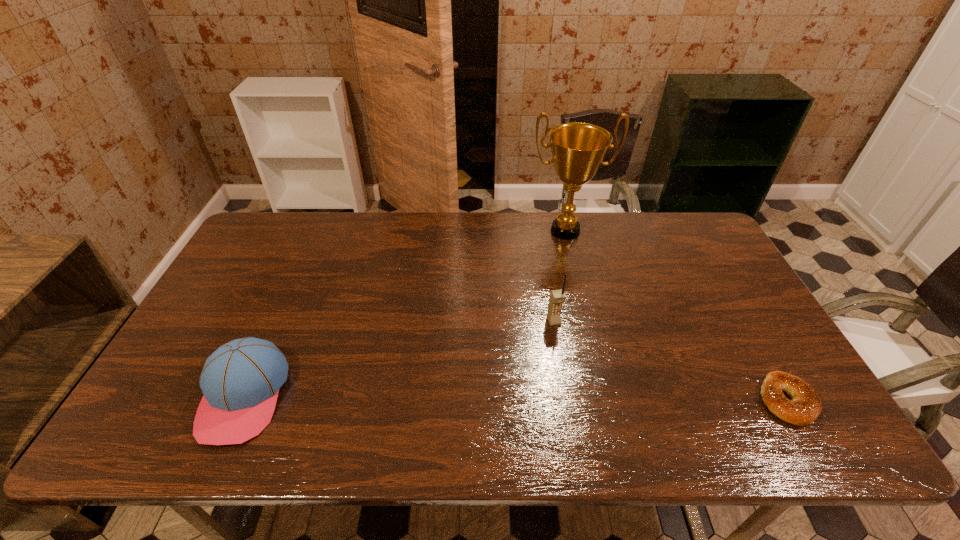
The image size is (960, 540). In order to click on free space on the desktop that is between the baseball cap and the rightmost object and is positioned on the front of the cellular telephone, where the keypad is located in this screenshot , I will do `click(584, 399)`.

Find the location of a particular element. The image size is (960, 540). free space on the desktop that is between the baseball cap and the shortest object and is positioned on the front view with handles of the farthest object is located at coordinates (595, 399).